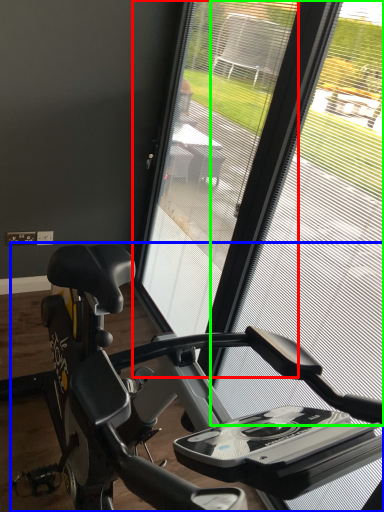
Question: Which object is the farthest from screen door (highlighted by a red box)? Choose among these: stationary bicycle (highlighted by a blue box) or window screen (highlighted by a green box).

Choices:
 (A) stationary bicycle
 (B) window screen

Answer: (B)